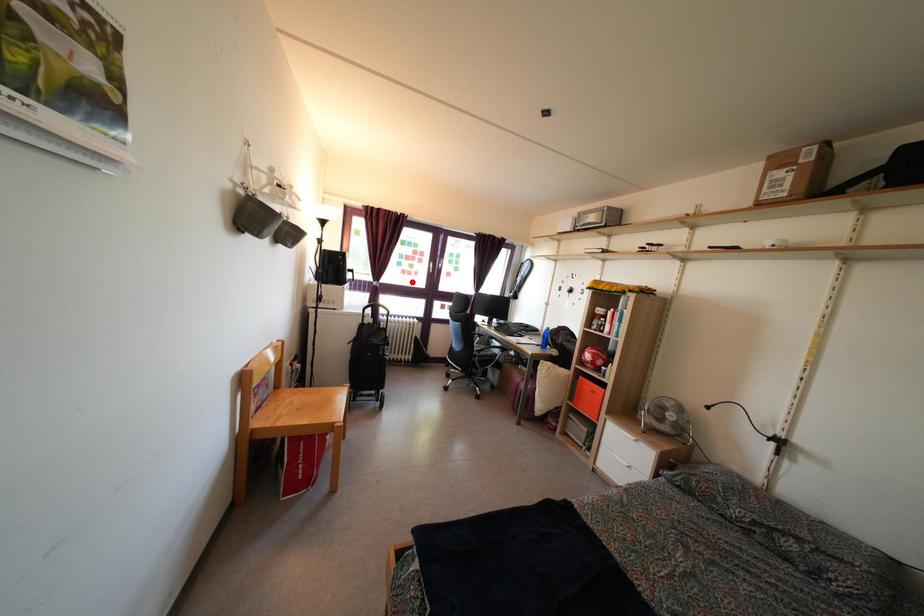
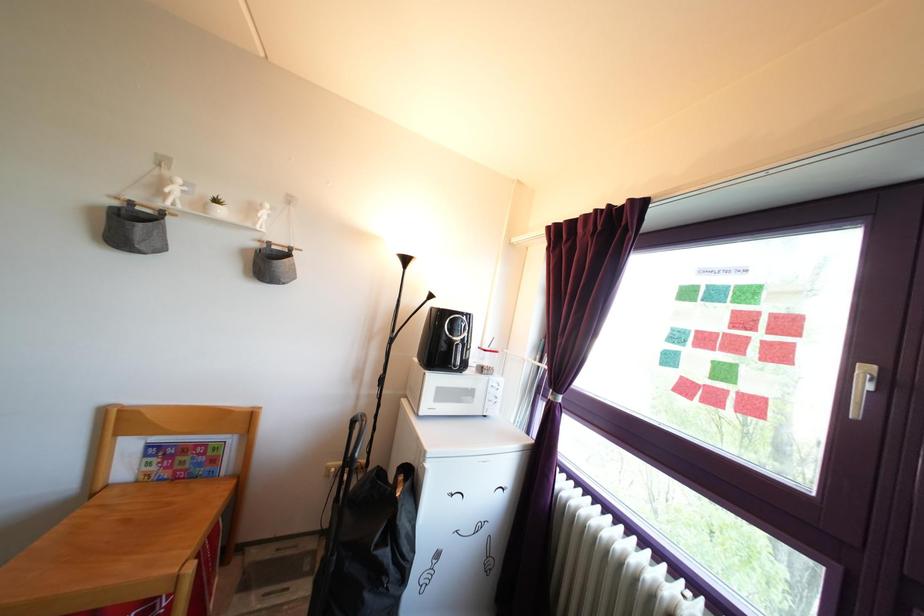
Where in the second image is the point corresponding to the highlighted location from the first image?

(715, 407)